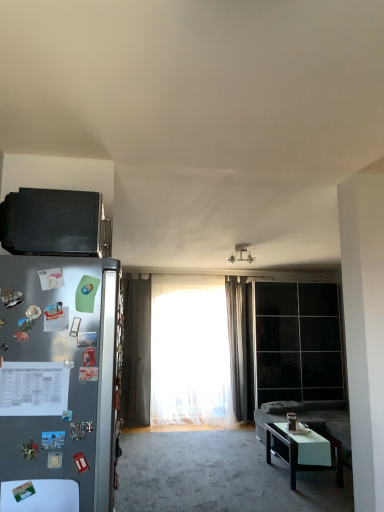
Question: Visually, is white glossy table at lower left positioned to the left or to the right of black glossy coffee table at lower right?

Choices:
 (A) left
 (B) right

Answer: (A)

Question: From a real-world perspective, is white glossy table at lower left above or below black glossy coffee table at lower right?

Choices:
 (A) below
 (B) above

Answer: (B)

Question: Considering the real-world distances, which object is farthest from the white sheer curtain at center, positioned as the first curtain in left-to-right order?

Choices:
 (A) satin silver refrigerator at left
 (B) black matte microwave at upper left
 (C) transparent glass door at center
 (D) black glossy coffee table at lower right
 (E) white glossy table at lower left

Answer: (E)

Question: Based on their relative distances, which object is nearer to the transparent glass door at center?

Choices:
 (A) white sheer curtain at center, arranged as the second curtain when viewed from the right
 (B) dark gray sheer curtain at center, which is the 2th curtain from left to right
 (C) black glossy coffee table at lower right
 (D) black matte microwave at upper left
 (E) satin silver refrigerator at left

Answer: (B)